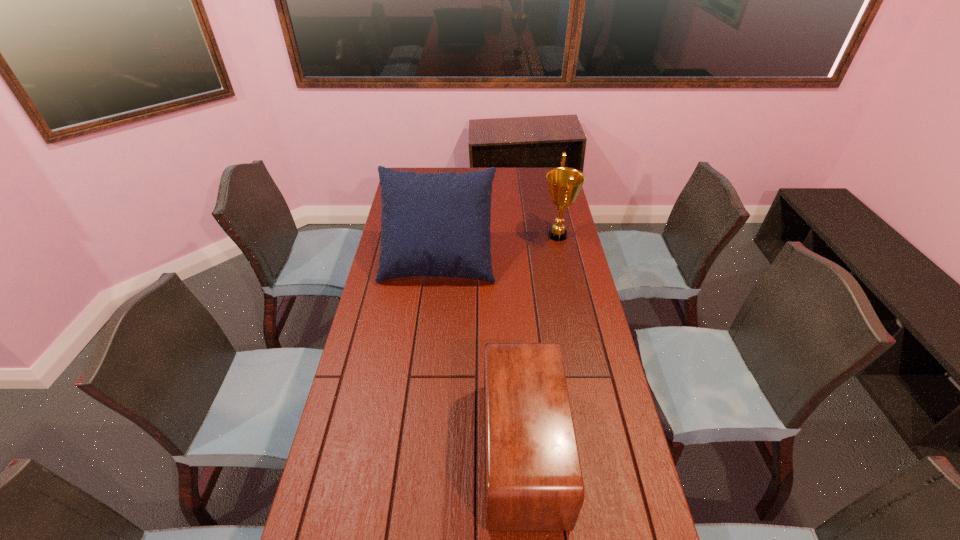
Where is `the rightmost object`? This screenshot has width=960, height=540. the rightmost object is located at coordinates (564, 183).

The image size is (960, 540). Find the location of `cushion`. cushion is located at coordinates (432, 224).

Where is `the shortest object`? This screenshot has height=540, width=960. the shortest object is located at coordinates (533, 479).

Find the location of a particular element. the nearest object is located at coordinates (533, 479).

Where is `vacant position located 0.320m on the front view with handles of the award`? vacant position located 0.320m on the front view with handles of the award is located at coordinates (465, 235).

Locate an element on the screen. The image size is (960, 540). free space located 0.090m on the front view with handles of the award is located at coordinates (519, 235).

Image resolution: width=960 pixels, height=540 pixels. I want to click on vacant space located on the front view with handles of the award, so click(x=495, y=235).

Where is `free space located on the facing side of the cushion`? The height and width of the screenshot is (540, 960). free space located on the facing side of the cushion is located at coordinates (429, 349).

This screenshot has width=960, height=540. What are the coordinates of `free spot located on the front panel of the nearest object` in the screenshot? It's located at (395, 451).

I want to click on vacant space located on the front panel of the nearest object, so click(379, 451).